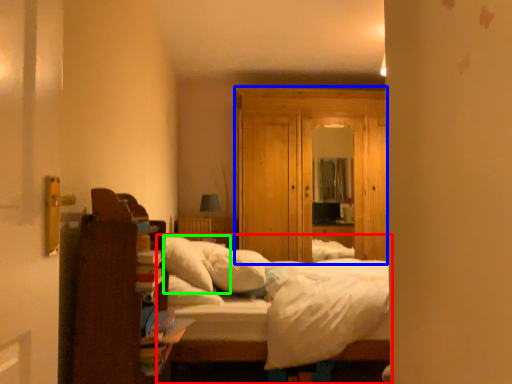
Question: Which is farther away from bed (highlighted by a red box)? dresser (highlighted by a blue box) or pillow (highlighted by a green box)?

Choices:
 (A) dresser
 (B) pillow

Answer: (A)